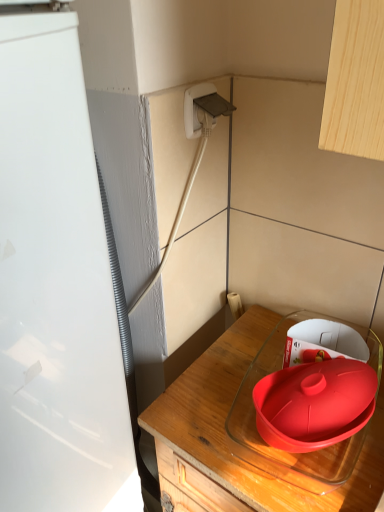
Question: Is point (6, 170) closer or farther from the camera than point (195, 93)?

Choices:
 (A) closer
 (B) farther

Answer: (A)

Question: Considering the positions of white glossy refrigerator at left and white plastic plug at upper center in the image, is white glossy refrigerator at left taller or shorter than white plastic plug at upper center?

Choices:
 (A) short
 (B) tall

Answer: (B)

Question: Which object is the closest to the transparent glass container at lower right?

Choices:
 (A) white glossy refrigerator at left
 (B) white plastic plug at upper center

Answer: (A)

Question: Estimate the real-world distances between objects in this image. Which object is farther from the white plastic plug at upper center?

Choices:
 (A) white glossy refrigerator at left
 (B) transparent glass container at lower right

Answer: (B)